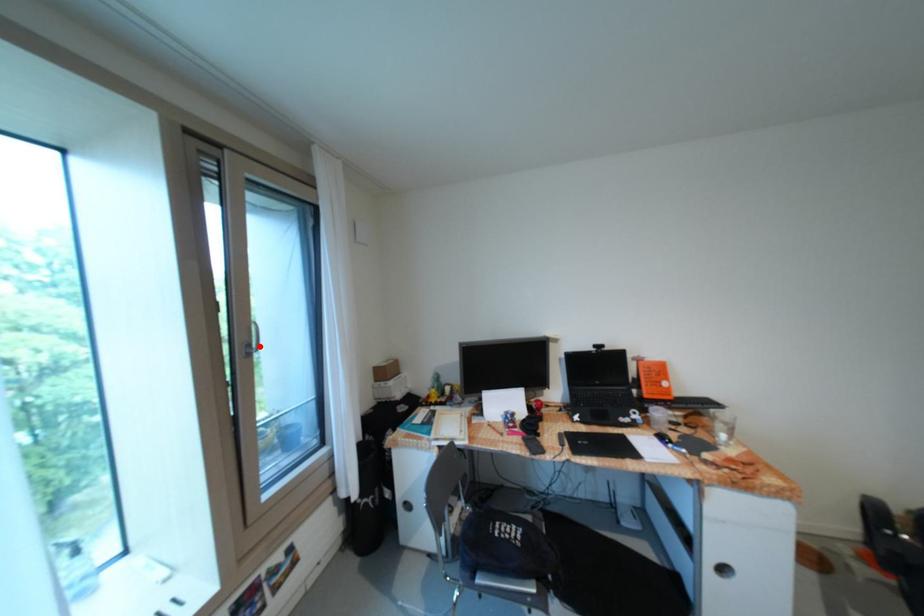
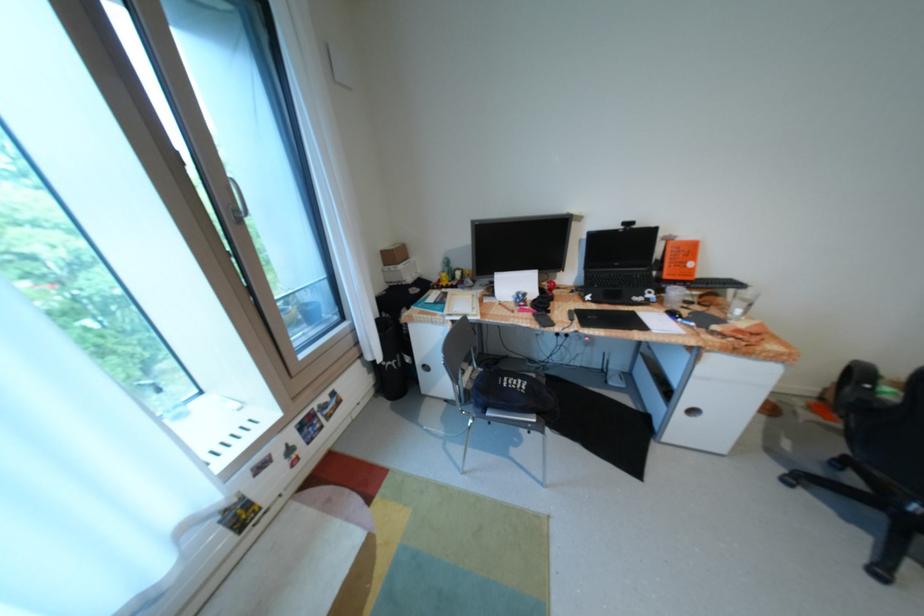
The point at the highlighted location is marked in the first image. Where is the corresponding point in the second image?

(247, 211)